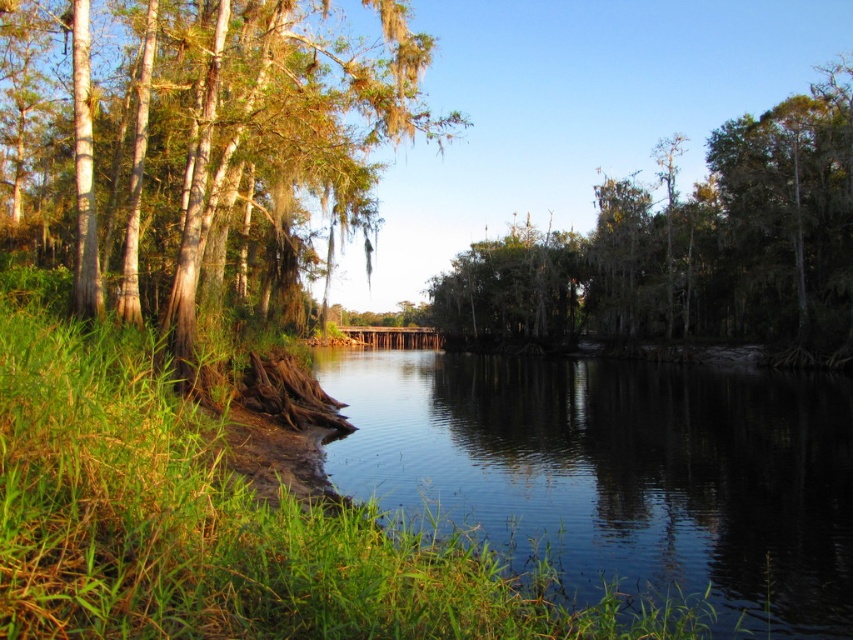
Who is more forward, [659,388] or [235,61]?

Positioned in front is point [235,61].

Between clear water at center and green mossy tree at left, which one has more height?

green mossy tree at left

Locate an element on the screen. clear water at center is located at coordinates (616, 474).

Image resolution: width=853 pixels, height=640 pixels. I want to click on clear water at center, so click(616, 474).

Between point (579, 532) and point (840, 64), which one is positioned in front?

Point (579, 532) is more forward.

Is clear water at center behind green mossy tree at center?

No, it is not.

The height and width of the screenshot is (640, 853). What do you see at coordinates (616, 474) in the screenshot?
I see `clear water at center` at bounding box center [616, 474].

I want to click on clear water at center, so click(616, 474).

Which is in front, point (131, 308) or point (450, 282)?

Positioned in front is point (131, 308).

This screenshot has width=853, height=640. What are the coordinates of `green mossy tree at left` in the screenshot? It's located at [198, 148].